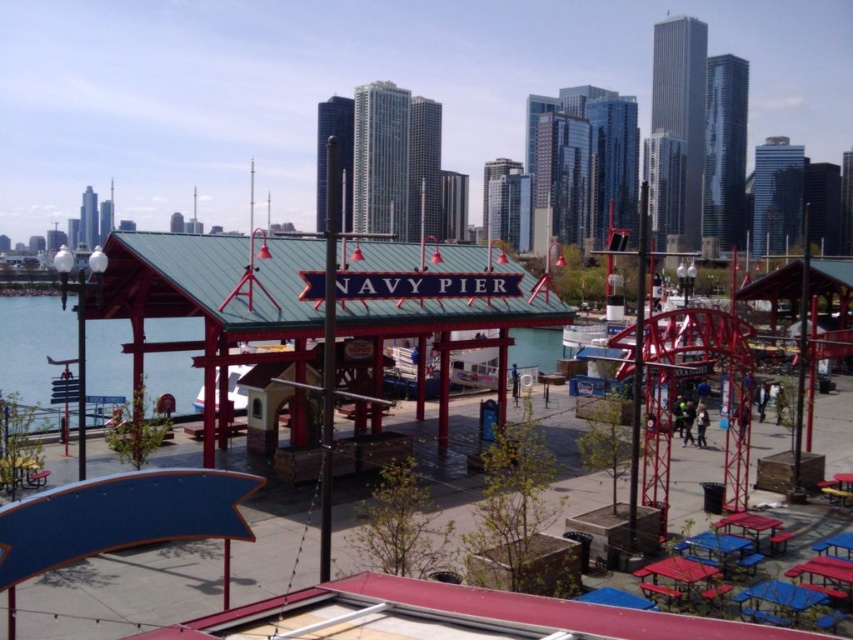
Question: Estimate the real-world distances between objects in this image. Which object is closer to the blue plastic picnic table at lower right?

Choices:
 (A) wooden picnic table at lower right
 (B) red plastic picnic table at lower right

Answer: (B)

Question: Which object is closer to the camera taking this photo?

Choices:
 (A) red plastic picnic table at lower right
 (B) wooden picnic table at lower right

Answer: (B)

Question: Is wooden picnic table at lower right positioned behind red plastic picnic table at lower right?

Choices:
 (A) no
 (B) yes

Answer: (A)

Question: Can you confirm if blue plastic picnic table at lower right is thinner than red plastic picnic table at lower right?

Choices:
 (A) yes
 (B) no

Answer: (B)

Question: Which of the following is the farthest from the observer?

Choices:
 (A) (730, 516)
 (B) (746, 570)
 (C) (675, 556)

Answer: (A)

Question: Is the position of wooden picnic table at lower right more distant than that of blue plastic picnic table at lower right?

Choices:
 (A) no
 (B) yes

Answer: (A)